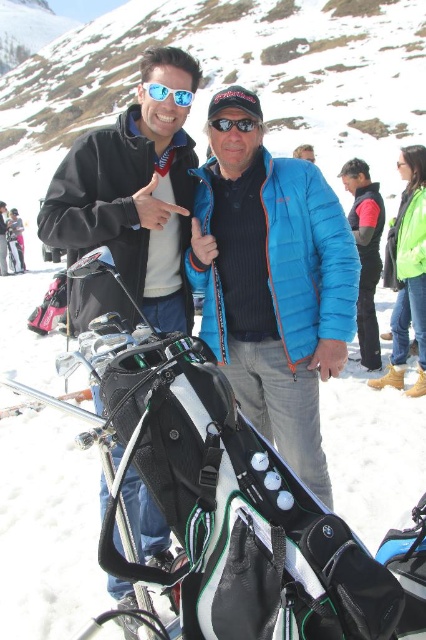
Is blue reflective sunglasses at upper center behind black matte sunglasses at center?

That is True.

Which is more to the left, blue reflective sunglasses at upper center or black matte sunglasses at center?

blue reflective sunglasses at upper center is more to the left.

At what (x,y) coordinates should I click in order to perform the action: click on blue reflective sunglasses at upper center. Please return your answer as a coordinate pair (x, y). This screenshot has width=426, height=640. Looking at the image, I should click on (167, 93).

Is blue quilted jacket at center shorter than matte black jacket at left?

Indeed, blue quilted jacket at center has a lesser height compared to matte black jacket at left.

Consider the image. Who is taller, blue quilted jacket at center or matte black jacket at left?

With more height is matte black jacket at left.

The width and height of the screenshot is (426, 640). In order to click on blue quilted jacket at center in this screenshot , I will do tap(273, 289).

Is blue quilted jacket at center smaller than blue quilted jacket at right?

No, blue quilted jacket at center is not smaller than blue quilted jacket at right.

Is blue quilted jacket at center below blue quilted jacket at right?

Indeed, blue quilted jacket at center is positioned under blue quilted jacket at right.

Between point (233, 332) and point (357, 182), which one is positioned in front?

Point (233, 332)

Identify the location of blue quilted jacket at center. (273, 289).